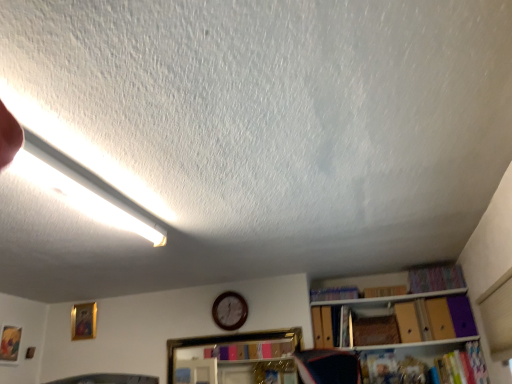
Question: Is wooden shelf at center taller or shorter than matte gold picture frame at lower left, acting as the first picture frame starting from the front?

Choices:
 (A) tall
 (B) short

Answer: (A)

Question: Relative to matte gold picture frame at lower left, positioned as the 1th picture frame in left-to-right order, is wooden shelf at center in front or behind?

Choices:
 (A) behind
 (B) front

Answer: (B)

Question: Which object is the closest to the white fluorescent tube at upper left?

Choices:
 (A) multicolored fabric book at upper right, marked as the 4th book in a bottom-to-top arrangement
 (B) wooden shelf at center
 (C) matte gold picture frame at lower left, the 2th picture frame viewed from the back
 (D) wooden clock at center
 (E) gold-framed picture at upper left, which is counted as the 2th picture frame, starting from the front

Answer: (B)

Question: Which is farther from the matte gold picture frame at lower left, positioned as the 1th picture frame in left-to-right order?

Choices:
 (A) white fluorescent tube at upper left
 (B) wooden shelf at center
 (C) multicolored fabric book at upper right, the 1th book from the top
 (D) gold-framed picture at upper left, the 2th picture frame from the left
 (E) blue fabric book at center, acting as the third book starting from the top

Answer: (C)